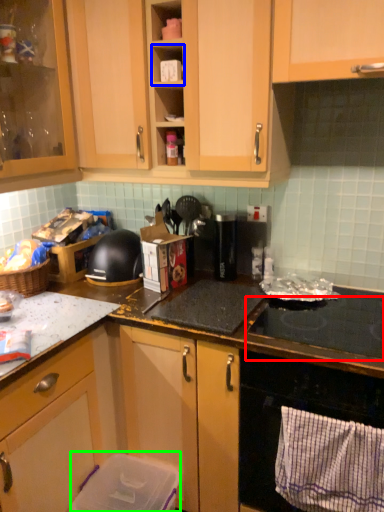
Question: Considering the real-world distances, which object is farthest from gas stove (highlighted by a red box)? shelf (highlighted by a blue box) or appliance (highlighted by a green box)?

Choices:
 (A) shelf
 (B) appliance

Answer: (A)